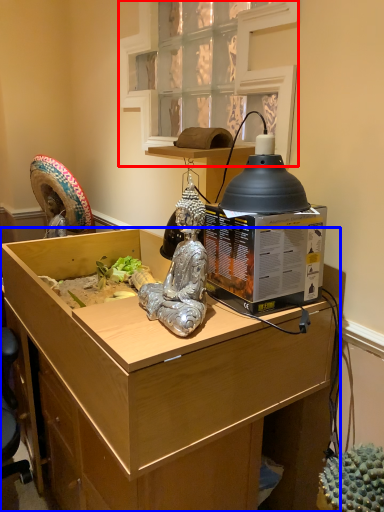
Question: Which of the following is the closest to the observer, window (highlighted by a red box) or desk (highlighted by a blue box)?

Choices:
 (A) window
 (B) desk

Answer: (B)